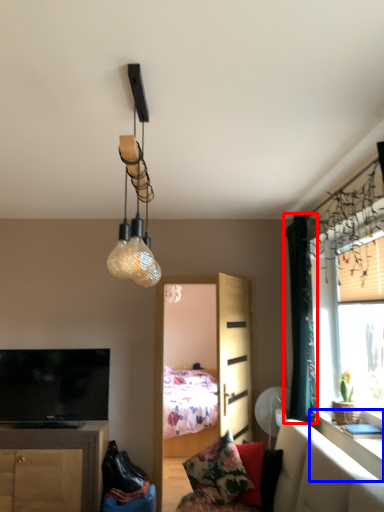
Question: Which object is closer to the camera taking this photo, curtain (highlighted by a red box) or table (highlighted by a blue box)?

Choices:
 (A) curtain
 (B) table

Answer: (B)